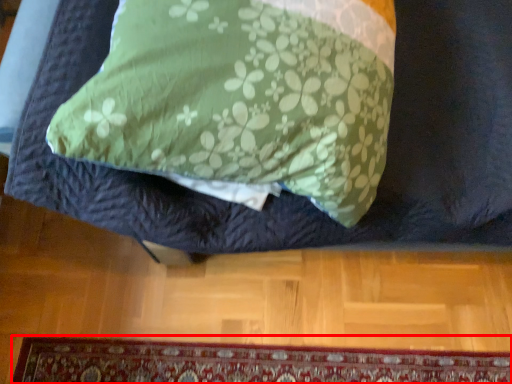
Question: From the image, what is the correct spatial relationship of mat (annotated by the red box) in relation to furniture?

Choices:
 (A) right
 (B) left

Answer: (B)